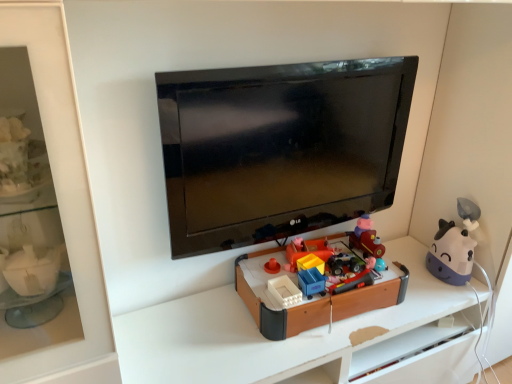
The image size is (512, 384). What do you see at coordinates (314, 299) in the screenshot?
I see `brown plastic toy at center, which is the fifth toy from right to left` at bounding box center [314, 299].

The width and height of the screenshot is (512, 384). Find the location of `purple matte cow at right, positioned as the 6th toy in left-to-right order`. purple matte cow at right, positioned as the 6th toy in left-to-right order is located at coordinates (454, 246).

I want to click on black glossy tv at center, so click(279, 147).

This screenshot has width=512, height=384. What do you see at coordinates (279, 147) in the screenshot?
I see `black glossy tv at center` at bounding box center [279, 147].

Where is `brown plastic toy at center, which appears as the 2th toy when viewed from the left`? The width and height of the screenshot is (512, 384). brown plastic toy at center, which appears as the 2th toy when viewed from the left is located at coordinates (314, 299).

Considering their positions, is rubberized plastic toy car at center, which is the third toy in right-to-left order, located in front of or behind bright orange plastic toy at center, acting as the sixth toy starting from the right?

rubberized plastic toy car at center, which is the third toy in right-to-left order, is positioned closer to the viewer than bright orange plastic toy at center, acting as the sixth toy starting from the right.

In the scene shown: Does rubberized plastic toy car at center, the fourth toy when ordered from left to right, turn towards bright orange plastic toy at center, the 1th toy from the left?

No, rubberized plastic toy car at center, the fourth toy when ordered from left to right, is not aimed at bright orange plastic toy at center, the 1th toy from the left.

Is point (368, 237) closer or farther from the camera than point (362, 284)?

Point (368, 237) is positioned farther from the camera compared to point (362, 284).

Considering the relative positions of matte plastic toy train at center, arranged as the fifth toy when viewed from the left, and rubberized plastic toy car at center, the 3th toy positioned from the left, in the image provided, is matte plastic toy train at center, arranged as the fifth toy when viewed from the left, to the right of rubberized plastic toy car at center, the 3th toy positioned from the left, from the viewer's perspective?

Yes, matte plastic toy train at center, arranged as the fifth toy when viewed from the left, is to the right of rubberized plastic toy car at center, the 3th toy positioned from the left.

Is rubberized plastic toy car at center, which ranks as the fourth toy in right-to-left order, completely or partially inside matte plastic toy train at center, arranged as the fifth toy when viewed from the left?

No.

The image size is (512, 384). I want to click on toy that is the 3rd object located in front of the matte plastic toy train at center, arranged as the fifth toy when viewed from the left, so click(356, 279).

From the image's perspective, is rubberized plastic toy car at center, which ranks as the fourth toy in right-to-left order, located beneath brown plastic toy at center, which appears as the 2th toy when viewed from the left?

Actually, rubberized plastic toy car at center, which ranks as the fourth toy in right-to-left order, appears above brown plastic toy at center, which appears as the 2th toy when viewed from the left, in the image.

Would you say brown plastic toy at center, which appears as the 2th toy when viewed from the left, is part of rubberized plastic toy car at center, the 3th toy positioned from the left,'s contents?

No, brown plastic toy at center, which appears as the 2th toy when viewed from the left, is not inside rubberized plastic toy car at center, the 3th toy positioned from the left.

Which object is positioned more to the right, rubberized plastic toy car at center, which ranks as the fourth toy in right-to-left order, or brown plastic toy at center, which is the fifth toy from right to left?

Positioned to the right is rubberized plastic toy car at center, which ranks as the fourth toy in right-to-left order.

Does bright orange plastic toy at center, the 1th toy from the left, have a greater width compared to purple matte cow at right, positioned as the 6th toy in left-to-right order?

No.

From the image's perspective, is bright orange plastic toy at center, the 1th toy from the left, positioned above or below purple matte cow at right, which is the first toy in right-to-left order?

From the image's perspective, bright orange plastic toy at center, the 1th toy from the left, appears above purple matte cow at right, which is the first toy in right-to-left order.

Considering the sizes of objects bright orange plastic toy at center, the 1th toy from the left, and purple matte cow at right, which is the first toy in right-to-left order, in the image provided, who is taller, bright orange plastic toy at center, the 1th toy from the left, or purple matte cow at right, which is the first toy in right-to-left order,?

purple matte cow at right, which is the first toy in right-to-left order, is taller.

Is bright orange plastic toy at center, acting as the sixth toy starting from the right, turned away from brown plastic toy at center, which is the fifth toy from right to left?

No, bright orange plastic toy at center, acting as the sixth toy starting from the right,'s orientation is not away from brown plastic toy at center, which is the fifth toy from right to left.

Which object is thinner, bright orange plastic toy at center, acting as the sixth toy starting from the right, or brown plastic toy at center, which is the fifth toy from right to left?

bright orange plastic toy at center, acting as the sixth toy starting from the right.

Is bright orange plastic toy at center, acting as the sixth toy starting from the right, to the left of brown plastic toy at center, which appears as the 2th toy when viewed from the left, from the viewer's perspective?

Yes, bright orange plastic toy at center, acting as the sixth toy starting from the right, is to the left of brown plastic toy at center, which appears as the 2th toy when viewed from the left.

The width and height of the screenshot is (512, 384). I want to click on the 5th toy behind the brown plastic toy at center, which appears as the 2th toy when viewed from the left, starting your count from the anchor, so click(x=306, y=251).

Does bright orange plastic toy at center, acting as the sixth toy starting from the right, have a larger size compared to matte plastic toy train at center, arranged as the fifth toy when viewed from the left?

No, bright orange plastic toy at center, acting as the sixth toy starting from the right, is not bigger than matte plastic toy train at center, arranged as the fifth toy when viewed from the left.

Between bright orange plastic toy at center, acting as the sixth toy starting from the right, and matte plastic toy train at center, which is the 2th toy in right-to-left order, which one appears on the right side from the viewer's perspective?

matte plastic toy train at center, which is the 2th toy in right-to-left order.

The image size is (512, 384). What are the coordinates of `the 4th toy counting from the left of the matte plastic toy train at center, arranged as the fifth toy when viewed from the left` in the screenshot? It's located at (306, 251).

Is matte plastic toy train at center, which is the 2th toy in right-to-left order, at the back of bright orange plastic toy at center, acting as the sixth toy starting from the right?

bright orange plastic toy at center, acting as the sixth toy starting from the right, is not turned away from matte plastic toy train at center, which is the 2th toy in right-to-left order.

Can you tell me how much rubberized plastic toy car at center, which ranks as the fourth toy in right-to-left order, and purple matte cow at right, positioned as the 6th toy in left-to-right order, differ in facing direction?

The angle between the facing direction of rubberized plastic toy car at center, which ranks as the fourth toy in right-to-left order, and the facing direction of purple matte cow at right, positioned as the 6th toy in left-to-right order, is 0.342 degrees.

Is rubberized plastic toy car at center, the 3th toy positioned from the left, oriented away from purple matte cow at right, positioned as the 6th toy in left-to-right order?

No, purple matte cow at right, positioned as the 6th toy in left-to-right order, is not at the back of rubberized plastic toy car at center, the 3th toy positioned from the left.

Is rubberized plastic toy car at center, which ranks as the fourth toy in right-to-left order, in contact with purple matte cow at right, which is the first toy in right-to-left order?

rubberized plastic toy car at center, which ranks as the fourth toy in right-to-left order, is not next to purple matte cow at right, which is the first toy in right-to-left order, and they're not touching.

Is rubberized plastic toy car at center, which ranks as the fourth toy in right-to-left order, spatially inside purple matte cow at right, positioned as the 6th toy in left-to-right order, or outside of it?

rubberized plastic toy car at center, which ranks as the fourth toy in right-to-left order, is not enclosed by purple matte cow at right, positioned as the 6th toy in left-to-right order.

Which toy is the 3rd one when counting from the left side of the rubberized plastic toy car at center, which is the third toy in right-to-left order? Please provide its 2D coordinates.

[(306, 251)]

The height and width of the screenshot is (384, 512). Identify the location of toy that is the 2nd one when counting rightward from the rubberized plastic toy car at center, which ranks as the fourth toy in right-to-left order. (366, 238).

From the image, which object appears to be nearer to matte plastic toy train at center, which is the 2th toy in right-to-left order, brown plastic toy at center, which is the fifth toy from right to left, or black glossy tv at center?

Based on the image, brown plastic toy at center, which is the fifth toy from right to left, appears to be nearer to matte plastic toy train at center, which is the 2th toy in right-to-left order.

Looking at the image, which one is located closer to black glossy tv at center, brown plastic toy at center, which appears as the 2th toy when viewed from the left, or bright orange plastic toy at center, acting as the sixth toy starting from the right?

Based on the image, brown plastic toy at center, which appears as the 2th toy when viewed from the left, appears to be nearer to black glossy tv at center.

Based on their spatial positions, is black glossy tv at center or rubberized plastic toy car at center, the 3th toy positioned from the left, further from matte plastic toy train at center, arranged as the fifth toy when viewed from the left?

black glossy tv at center lies further to matte plastic toy train at center, arranged as the fifth toy when viewed from the left, than the other object.

Based on their spatial positions, is brown plastic toy at center, which is the fifth toy from right to left, or purple matte cow at right, which is the first toy in right-to-left order, closer to bright orange plastic toy at center, acting as the sixth toy starting from the right?

brown plastic toy at center, which is the fifth toy from right to left, is closer to bright orange plastic toy at center, acting as the sixth toy starting from the right.

Considering their positions, is rubberized plastic toy car at center, which ranks as the fourth toy in right-to-left order, positioned further to matte plastic toy train at center, arranged as the fifth toy when viewed from the left, than bright orange plastic toy at center, the 1th toy from the left?

Among the two, bright orange plastic toy at center, the 1th toy from the left, is located further to matte plastic toy train at center, arranged as the fifth toy when viewed from the left.

Based on their spatial positions, is rubberized plastic toy car at center, which ranks as the fourth toy in right-to-left order, or brown plastic toy at center, which appears as the 2th toy when viewed from the left, closer to bright orange plastic toy at center, acting as the sixth toy starting from the right?

Based on the image, brown plastic toy at center, which appears as the 2th toy when viewed from the left, appears to be nearer to bright orange plastic toy at center, acting as the sixth toy starting from the right.

When comparing their distances from bright orange plastic toy at center, acting as the sixth toy starting from the right, does rubberized plastic toy car at center, the 3th toy positioned from the left, or rubberized plastic toy car at center, which is the third toy in right-to-left order, seem further?

Among the two, rubberized plastic toy car at center, the 3th toy positioned from the left, is located further to bright orange plastic toy at center, acting as the sixth toy starting from the right.

Based on their spatial positions, is purple matte cow at right, which is the first toy in right-to-left order, or bright orange plastic toy at center, acting as the sixth toy starting from the right, further from rubberized plastic toy car at center, the fourth toy when ordered from left to right?

Based on the image, purple matte cow at right, which is the first toy in right-to-left order, appears to be further to rubberized plastic toy car at center, the fourth toy when ordered from left to right.

I want to click on toy situated between rubberized plastic toy car at center, the fourth toy when ordered from left to right, and purple matte cow at right, which is the first toy in right-to-left order, from left to right, so click(366, 238).

Where is `toy situated between rubberized plastic toy car at center, which ranks as the fourth toy in right-to-left order, and matte plastic toy train at center, arranged as the fifth toy when viewed from the left, from left to right`? Image resolution: width=512 pixels, height=384 pixels. toy situated between rubberized plastic toy car at center, which ranks as the fourth toy in right-to-left order, and matte plastic toy train at center, arranged as the fifth toy when viewed from the left, from left to right is located at coordinates (345, 264).

I want to click on toy located between brown plastic toy at center, which appears as the 2th toy when viewed from the left, and rubberized plastic toy car at center, which is the third toy in right-to-left order, in the depth direction, so click(x=356, y=279).